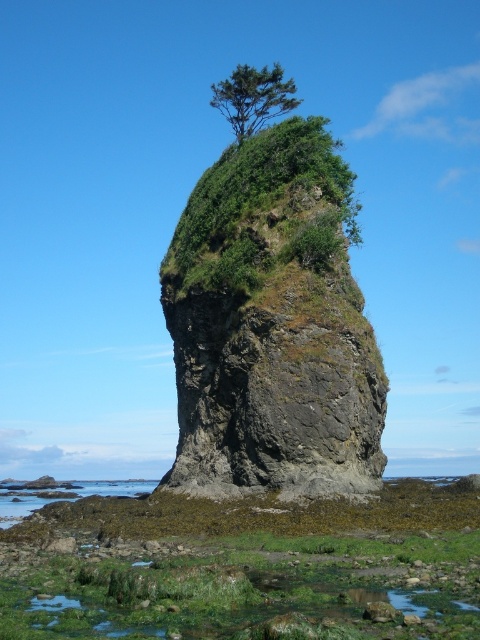
You are a hiker who wants to take a photo of the green leafy vegetation at center and the green leafy tree at upper center. Which one should you focus on first if you want to capture both in one frame without moving your camera?

You should focus on the green leafy tree at upper center first because it is taller than the green leafy vegetation at center, so it will appear larger in the frame and help balance the composition.

You are a hiker standing at the base of the sea stack and want to reach the top. You notice two points marked on your map corresponding to coordinates point (x=360, y=412) and point (x=223, y=179). Which coordinate should you head towards first to reach the top of the sea stack?

You should head towards point (x=360, y=412) first because it is in front of point (x=223, y=179), meaning it is closer to the base of the sea stack and the starting point.

You are a geologist examining the sea stack. You notice the green mossy rock at center and the green leafy tree at upper center. Which object has a greater width?

The green mossy rock at center has a greater width than the green leafy tree at upper center.